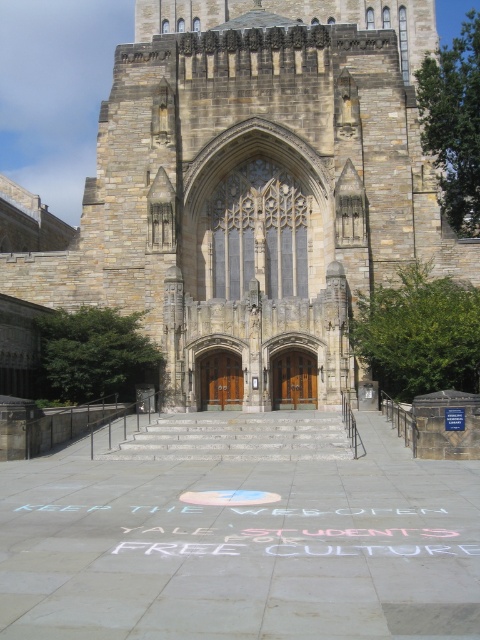
You are a delivery person trying to enter the stone church at center through the brown wooden doors at center. The doors are locked, but you see a keyhole. The key you have is 5 cm wide. Can you determine if the key will fit into the keyhole?

The stone church at center is bigger than brown wooden doors at center, but this does not provide information about the size of the keyhole. You cannot determine if the key will fit based on the given information.

You are a visitor approaching the historic stone building. You see the white chalk writing at center and the brown wooden door at center. Which object is closer to you as you approach the building from the front steps?

The white chalk writing at center is closer to you because it is in front of the brown wooden door at center, meaning it is positioned nearer to the front steps where you are approaching from.